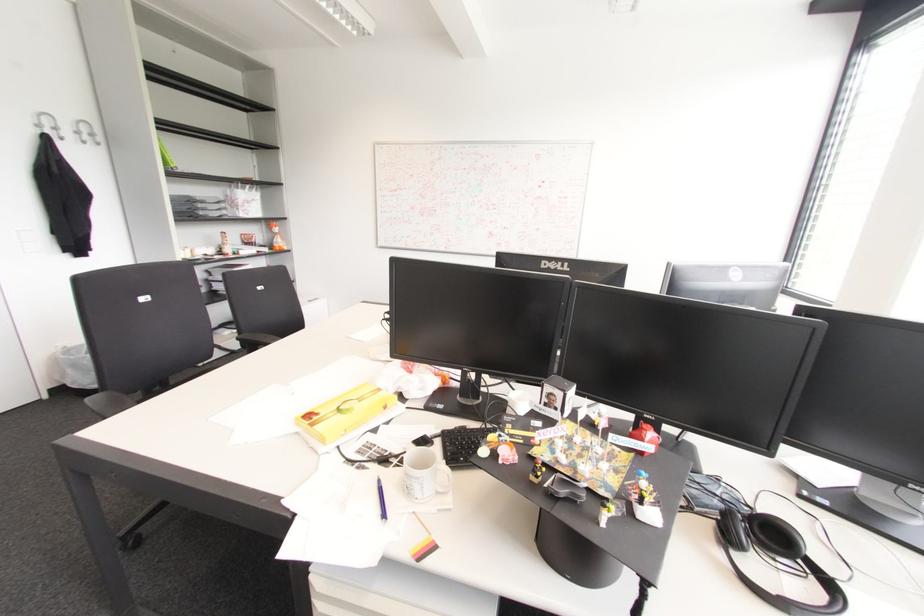
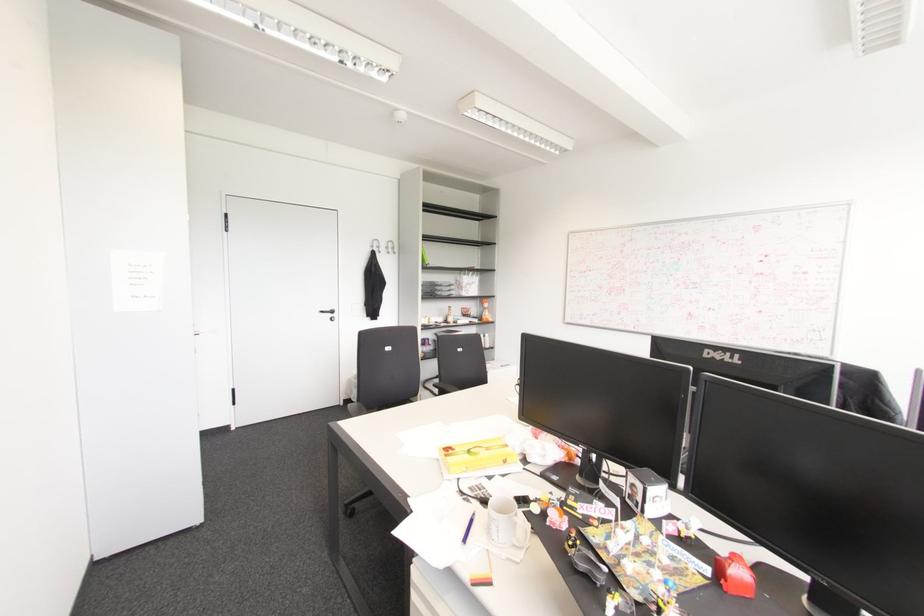
Question: Based on the continuous images, in which direction is the camera rotating? Reply with the corresponding letter.

Choices:
 (A) Left
 (B) Right
 (C) Up
 (D) Down

Answer: (A)